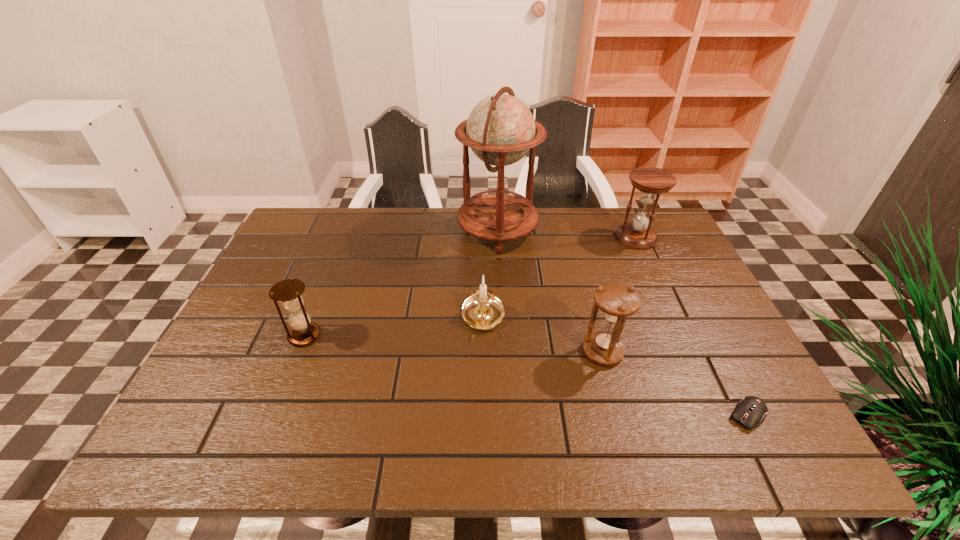
Locate an element on the screen. free region located 0.200m on the surface of the tallest object is located at coordinates (394, 231).

At what (x,y) coordinates should I click in order to perform the action: click on free space located 0.150m on the front of the farthest hourglass. Please return your answer as a coordinate pair (x, y). The height and width of the screenshot is (540, 960). Looking at the image, I should click on (658, 285).

The height and width of the screenshot is (540, 960). Identify the location of free location located on the right of the second hourglass from right to left. (741, 352).

This screenshot has width=960, height=540. What are the coordinates of `free region located on the right of the shortest hourglass` in the screenshot? It's located at (434, 335).

Locate an element on the screen. The image size is (960, 540). vacant space positioned on the handle side of the second shortest object is located at coordinates (484, 434).

Locate an element on the screen. The width and height of the screenshot is (960, 540). free space located 0.240m on the back of the shortest object is located at coordinates (697, 316).

I want to click on globe that is at the far edge, so click(500, 130).

The image size is (960, 540). In order to click on hourglass that is at the far edge in this screenshot , I will do `click(650, 181)`.

Locate an element on the screen. The image size is (960, 540). object that is at the near edge is located at coordinates (751, 410).

In order to click on object located in the left edge section of the desktop in this screenshot , I will do `click(289, 292)`.